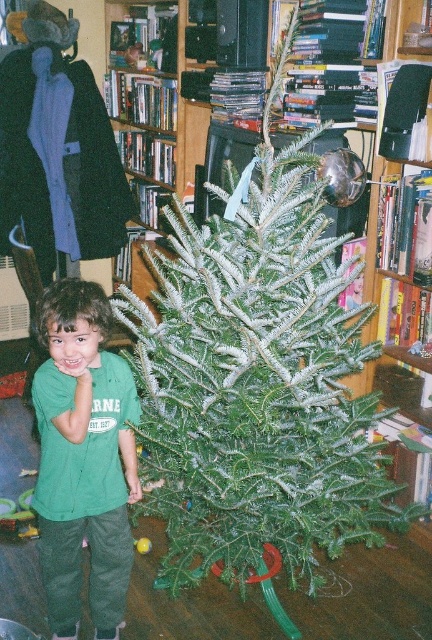
Can you confirm if green textured christmas tree at center is positioned to the right of green cotton shirt at center?

Correct, you'll find green textured christmas tree at center to the right of green cotton shirt at center.

Is green textured christmas tree at center positioned behind green cotton shirt at center?

No, it is in front of green cotton shirt at center.

Where is `green textured christmas tree at center`? green textured christmas tree at center is located at coordinates (257, 384).